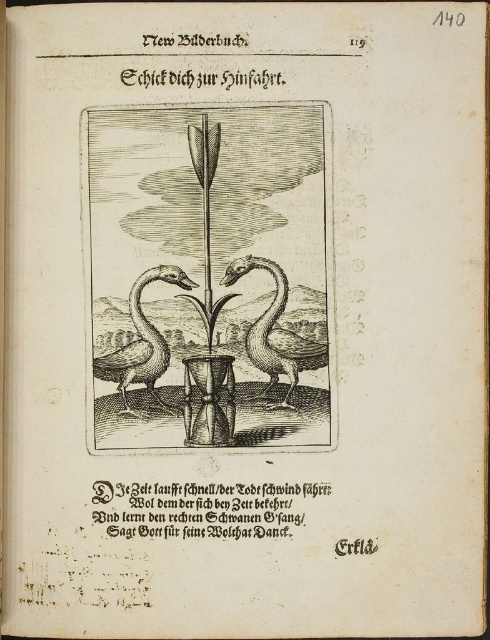
Question: Is wooden pedestal with two swans at center further to camera compared to gray wood swan at left?

Choices:
 (A) no
 (B) yes

Answer: (A)

Question: Based on their relative distances, which object is farther from the smooth silver swan at center?

Choices:
 (A) wooden pedestal with two swans at center
 (B) gray wood swan at left

Answer: (B)

Question: Which of these objects is positioned farthest from the smooth silver swan at center?

Choices:
 (A) wooden pedestal with two swans at center
 (B) gray wood swan at left

Answer: (B)

Question: Is smooth silver swan at center bigger than gray wood swan at left?

Choices:
 (A) no
 (B) yes

Answer: (B)

Question: Does wooden pedestal with two swans at center appear on the right side of gray wood swan at left?

Choices:
 (A) no
 (B) yes

Answer: (B)

Question: Which object is farther from the camera taking this photo?

Choices:
 (A) smooth silver swan at center
 (B) wooden pedestal with two swans at center
 (C) gray wood swan at left

Answer: (C)